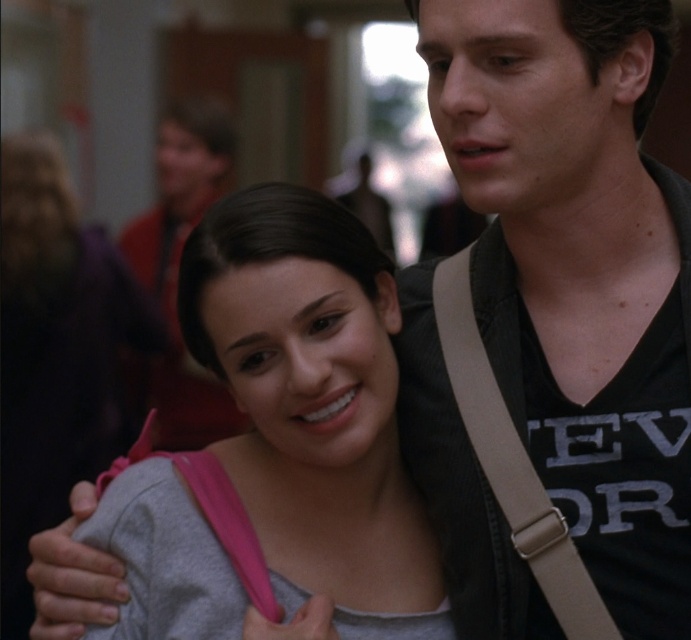
You are a photographer setting up a photo shoot in a school hallway. You need to ensure that the gray matte tank top at center and the tan fabric strap at center are both visible in the frame. Given their sizes, which object should you focus on to ensure both are in the shot without cropping?

The gray matte tank top at center is larger in size than the tan fabric strap at center, so focusing on the larger gray matte tank top at center will ensure both objects are included in the frame without cropping.

Looking at this image, you are a photographer trying to capture the best angle of the two people in the hallway. You notice the gray matte tank top at center and the tan fabric strap at center. Which object is positioned closer to you?

The gray matte tank top at center is closer to the viewer than the tan fabric strap at center.